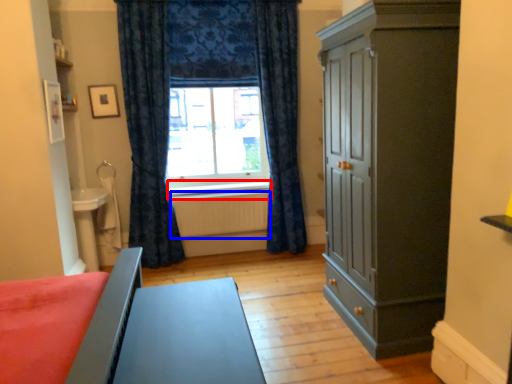
Question: Which object appears closest to the camera in this image, window sill (highlighted by a red box) or radiator (highlighted by a blue box)?

Choices:
 (A) window sill
 (B) radiator

Answer: (B)